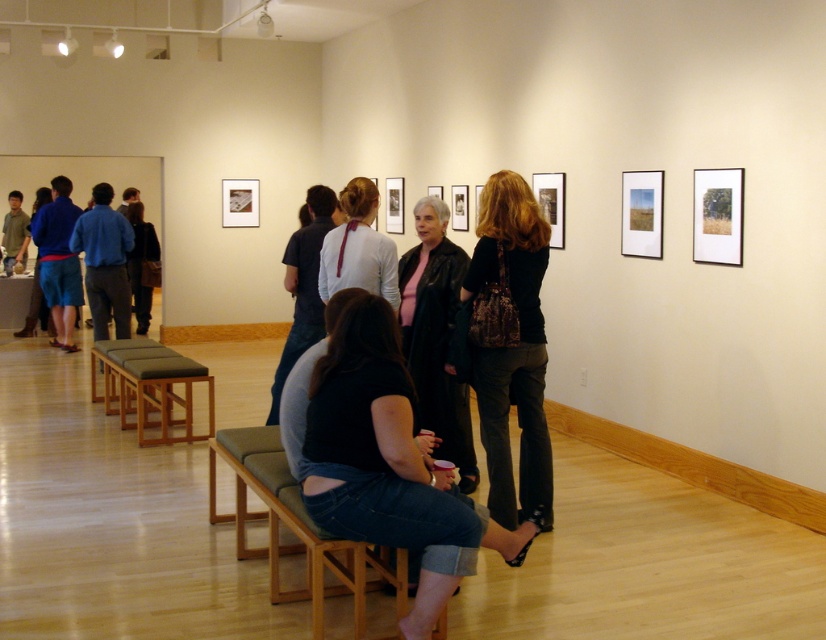
Question: Is denim jeans at center positioned behind wooden bench at lower left?

Choices:
 (A) no
 (B) yes

Answer: (A)

Question: Which of these objects is positioned farthest from the light pink silky blouse at center?

Choices:
 (A) leather jacket at center
 (B) matte blue shirt at center

Answer: (B)

Question: Among these objects, which one is nearest to the camera?

Choices:
 (A) matte blue shirt at center
 (B) denim jeans at center
 (C) shiny black purse at center
 (D) wooden bench at lower left

Answer: (B)

Question: Considering the real-world distances, which object is closest to the shiny black purse at center?

Choices:
 (A) matte blue shirt at center
 (B) light pink silky blouse at center
 (C) leather jacket at center

Answer: (C)

Question: Can you confirm if denim jeans at center is wider than leather jacket at center?

Choices:
 (A) no
 (B) yes

Answer: (B)

Question: Can you confirm if leather jacket at center is wider than wooden bench at lower left?

Choices:
 (A) no
 (B) yes

Answer: (A)